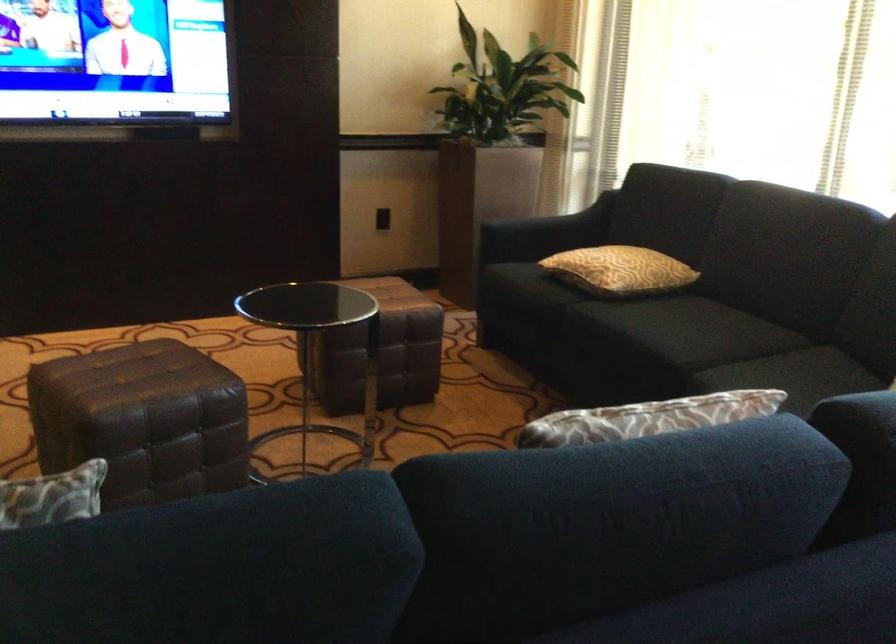
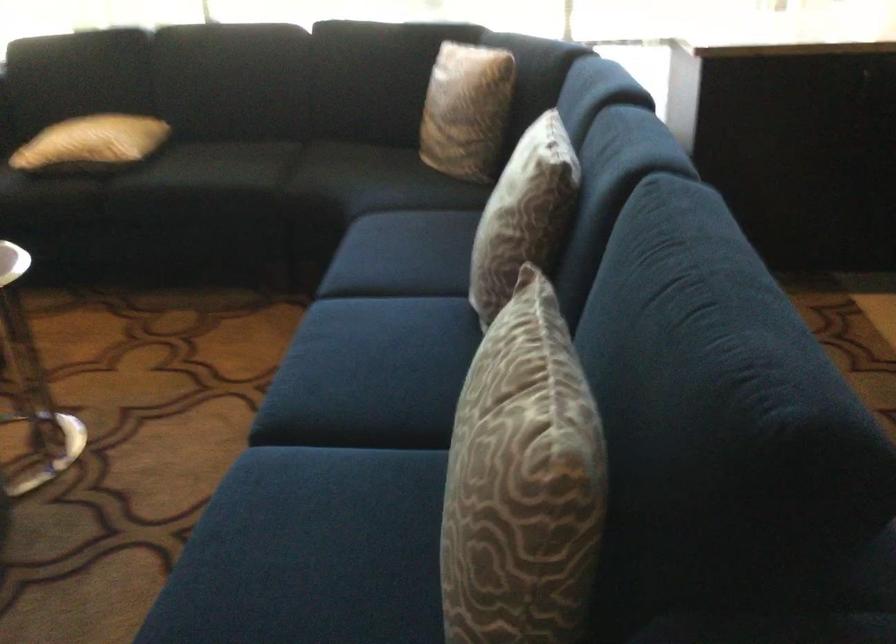
Find the pixel in the second image that matches (x=666, y=198) in the first image.

(82, 64)